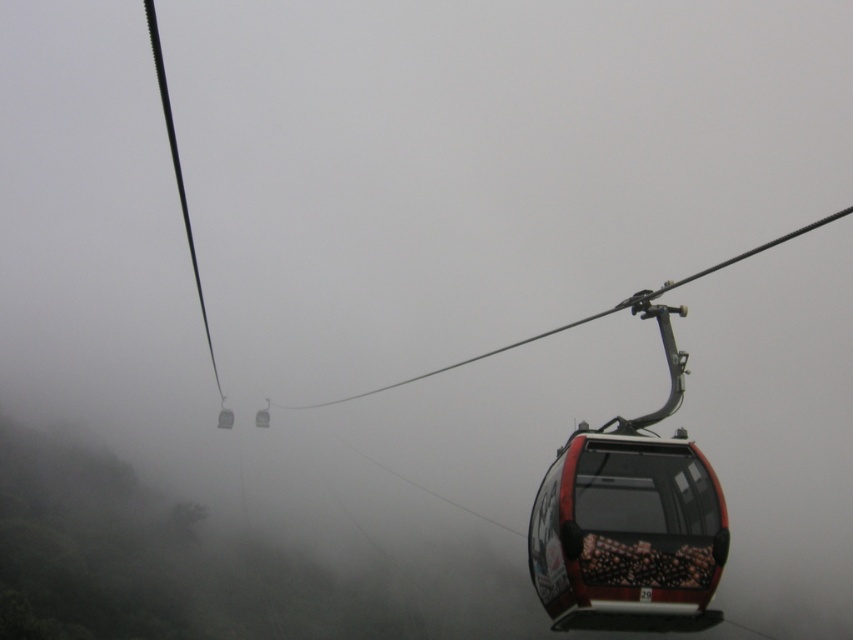
Looking at this image, between metallic red cable car at center and metallic gray cable car at center, which one appears on the left side from the viewer's perspective?

metallic gray cable car at center is more to the left.

Is point (672, 540) more distant than point (225, 426)?

No, (672, 540) is closer to viewer.

At what (x,y) coordinates should I click in order to perform the action: click on metallic red cable car at center. Please return your answer as a coordinate pair (x, y). Looking at the image, I should click on (627, 536).

Image resolution: width=853 pixels, height=640 pixels. Describe the element at coordinates (225, 419) in the screenshot. I see `metallic gray cable car at center` at that location.

Does point (219, 410) lie in front of point (260, 410)?

No, (219, 410) is further to viewer.

Which is behind, point (219, 428) or point (265, 426)?

The point (219, 428) is more distant.

The image size is (853, 640). Identify the location of metallic gray cable car at center. (225, 419).

How distant is metallic red cable car at center from metallic cable car at center?

metallic red cable car at center is 86.02 feet from metallic cable car at center.

Between point (648, 598) and point (259, 417), which one is positioned behind?

The point (259, 417) is more distant.

The image size is (853, 640). Describe the element at coordinates (627, 536) in the screenshot. I see `metallic red cable car at center` at that location.

The height and width of the screenshot is (640, 853). I want to click on metallic red cable car at center, so click(627, 536).